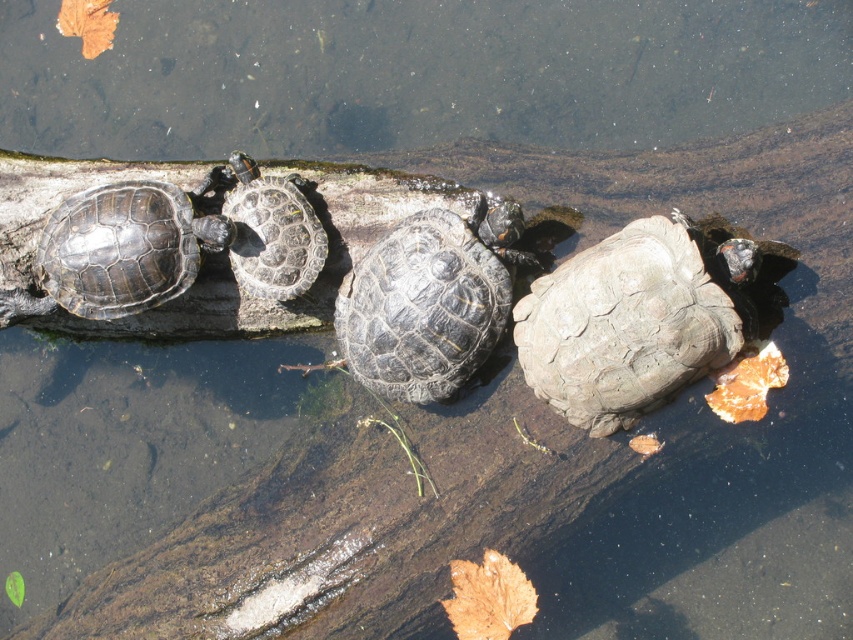
Does gray textured shell at center appear on the right side of shiny dark gray tortoise at left?

Indeed, gray textured shell at center is positioned on the right side of shiny dark gray tortoise at left.

What do you see at coordinates (624, 326) in the screenshot? The image size is (853, 640). I see `gray textured shell at center` at bounding box center [624, 326].

This screenshot has height=640, width=853. What do you see at coordinates (624, 326) in the screenshot? I see `gray textured shell at center` at bounding box center [624, 326].

Find the location of a particular element. gray textured shell at center is located at coordinates (624, 326).

Does shiny dark gray tortoise at left appear on the left side of smooth gray tortoise at right?

Indeed, shiny dark gray tortoise at left is positioned on the left side of smooth gray tortoise at right.

Which is in front, point (55, 304) or point (712, 262)?

Positioned in front is point (712, 262).

Is point (33, 305) positioned behind point (741, 278)?

Yes, point (33, 305) is behind point (741, 278).

You are a GUI agent. You are given a task and a screenshot of the screen. Output one action in this format:
    pyautogui.click(x=<x>, y=<y>)
    Task: Click on the shiny dark gray tortoise at left
    The width and height of the screenshot is (853, 640).
    Given the screenshot: What is the action you would take?
    pyautogui.click(x=125, y=248)

From the picture: Does shiny dark gray tortoise at left appear under shiny dark gray tortoise at center?

Indeed, shiny dark gray tortoise at left is positioned under shiny dark gray tortoise at center.

Does shiny dark gray tortoise at left appear on the right side of shiny dark gray tortoise at center?

Incorrect, shiny dark gray tortoise at left is not on the right side of shiny dark gray tortoise at center.

Find the location of a particular element. This screenshot has width=853, height=640. shiny dark gray tortoise at left is located at coordinates (125, 248).

Find the location of a particular element. The image size is (853, 640). shiny dark gray tortoise at left is located at coordinates (125, 248).